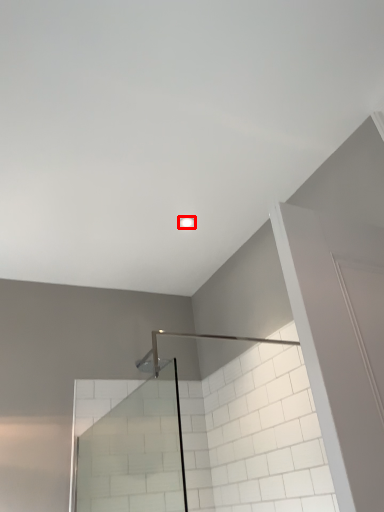
Question: From the image's perspective, where is light fixture (annotated by the red box) located relative to glass door?

Choices:
 (A) above
 (B) below

Answer: (A)